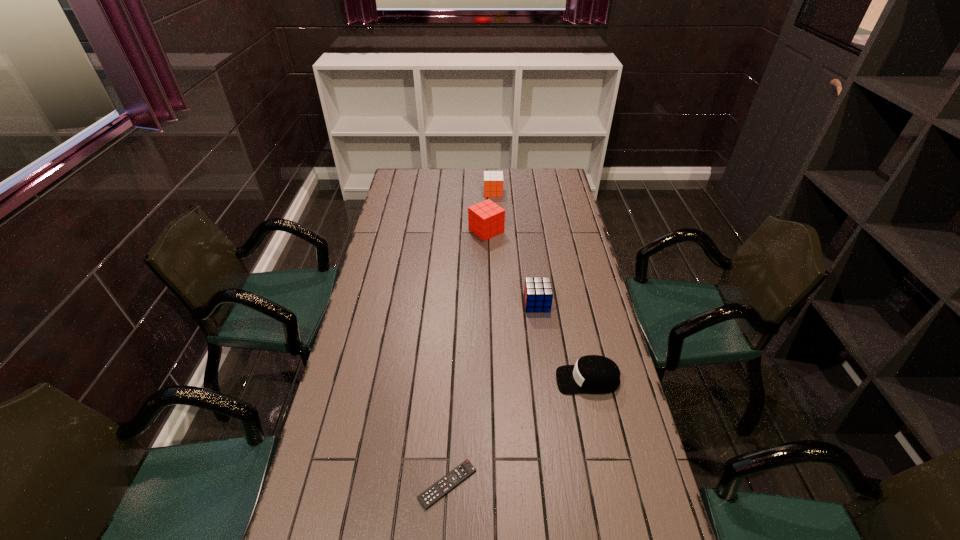
Locate an element on the screen. The image size is (960, 540). blank space located on the back of the nearest cube is located at coordinates (531, 258).

The width and height of the screenshot is (960, 540). In order to click on vacant region located on the front-facing side of the fourth farthest object in this screenshot , I will do `click(437, 380)`.

Find the location of a particular element. The width and height of the screenshot is (960, 540). vacant space positioned 0.230m on the front-facing side of the fourth farthest object is located at coordinates (482, 380).

Find the location of `vacant space located 0.250m on the front-facing side of the fourth farthest object`. vacant space located 0.250m on the front-facing side of the fourth farthest object is located at coordinates (476, 380).

Identify the location of vacant space located 0.090m on the left of the remote control. This screenshot has height=540, width=960. (384, 484).

Locate an element on the screen. object situated at the far edge is located at coordinates tap(493, 180).

Locate an element on the screen. object at the right edge is located at coordinates (592, 374).

The height and width of the screenshot is (540, 960). Identify the location of blank space at the far edge of the desktop. (464, 186).

In the image, there is a desktop. At what (x,y) coordinates should I click in order to perform the action: click on free space at the left edge. Please return your answer as a coordinate pair (x, y). This screenshot has width=960, height=540. Looking at the image, I should click on (336, 448).

In the image, there is a desktop. Identify the location of vacant space at the right edge. (571, 331).